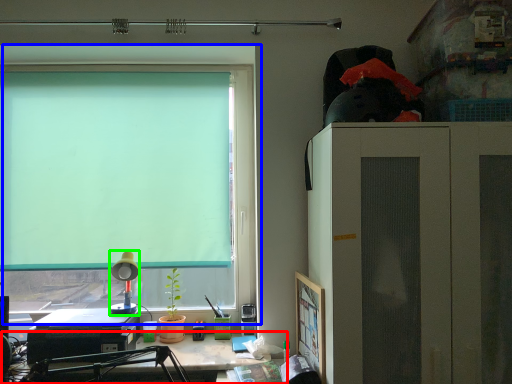
Question: Which object is the closest to the desk (highlighted by a red box)? Choose among these: window (highlighted by a blue box) or lamp (highlighted by a green box).

Choices:
 (A) window
 (B) lamp

Answer: (B)